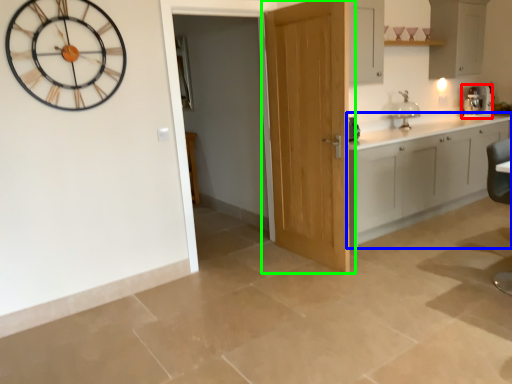
Question: Based on their relative distances, which object is nearer to coffee machine (highlighted by a red box)? Choose from cabinetry (highlighted by a blue box) and door (highlighted by a green box).

Choices:
 (A) cabinetry
 (B) door

Answer: (A)